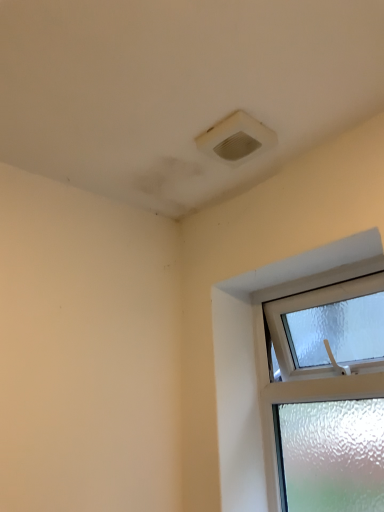
Describe the element at coordinates (265, 359) in the screenshot. The image size is (384, 512). I see `clear glass window at upper right` at that location.

Where is `clear glass window at upper right`? The height and width of the screenshot is (512, 384). clear glass window at upper right is located at coordinates (265, 359).

The height and width of the screenshot is (512, 384). Find the location of `white plastic air conditioning at upper center`. white plastic air conditioning at upper center is located at coordinates 236,139.

The image size is (384, 512). Describe the element at coordinates (236, 139) in the screenshot. I see `white plastic air conditioning at upper center` at that location.

Locate an element on the screen. This screenshot has width=384, height=512. clear glass window at upper right is located at coordinates (265, 359).

Which is more to the left, white plastic air conditioning at upper center or clear glass window at upper right?

white plastic air conditioning at upper center is more to the left.

Which is behind, white plastic air conditioning at upper center or clear glass window at upper right?

white plastic air conditioning at upper center is further away from the camera.

Does point (218, 150) come in front of point (238, 426)?

Yes, it is.

From the image's perspective, between white plastic air conditioning at upper center and clear glass window at upper right, which one is located above?

white plastic air conditioning at upper center, from the image's perspective.

From a real-world perspective, is white plastic air conditioning at upper center physically located above or below clear glass window at upper right?

In terms of real-world spatial position, white plastic air conditioning at upper center is above clear glass window at upper right.

Considering the sizes of objects white plastic air conditioning at upper center and clear glass window at upper right in the image provided, who is thinner, white plastic air conditioning at upper center or clear glass window at upper right?

With smaller width is clear glass window at upper right.

Is white plastic air conditioning at upper center shorter than clear glass window at upper right?

Correct, white plastic air conditioning at upper center is not as tall as clear glass window at upper right.

Between white plastic air conditioning at upper center and clear glass window at upper right, which one has larger size?

With larger size is clear glass window at upper right.

Can we say white plastic air conditioning at upper center lies outside clear glass window at upper right?

white plastic air conditioning at upper center lies outside clear glass window at upper right's area.

Is white plastic air conditioning at upper center directly adjacent to clear glass window at upper right?

No, white plastic air conditioning at upper center is not making contact with clear glass window at upper right.

In the scene shown: Is white plastic air conditioning at upper center facing towards clear glass window at upper right?

No, white plastic air conditioning at upper center is not facing towards clear glass window at upper right.

Measure the distance between white plastic air conditioning at upper center and clear glass window at upper right.

A distance of 22.65 inches exists between white plastic air conditioning at upper center and clear glass window at upper right.

Find the location of a particular element. Image resolution: width=384 pixels, height=512 pixels. air conditioning that is above the clear glass window at upper right (from the image's perspective) is located at coordinates (236, 139).

Considering the positions of objects clear glass window at upper right and white plastic air conditioning at upper center in the image provided, who is more to the right, clear glass window at upper right or white plastic air conditioning at upper center?

clear glass window at upper right is more to the right.

Which object is closer to the camera taking this photo, clear glass window at upper right or white plastic air conditioning at upper center?

clear glass window at upper right is in front.

Which is closer to the camera, (251, 304) or (201, 148)?

The point (201, 148) is more forward.

From the image's perspective, between clear glass window at upper right and white plastic air conditioning at upper center, who is located below?

From the image's view, clear glass window at upper right is below.

From a real-world perspective, is clear glass window at upper right under white plastic air conditioning at upper center?

Yes, from a real-world perspective, clear glass window at upper right is below white plastic air conditioning at upper center.

Between clear glass window at upper right and white plastic air conditioning at upper center, which one has smaller width?

With smaller width is clear glass window at upper right.

Considering the sizes of clear glass window at upper right and white plastic air conditioning at upper center in the image, is clear glass window at upper right taller or shorter than white plastic air conditioning at upper center?

Clearly, clear glass window at upper right is taller compared to white plastic air conditioning at upper center.

Considering the sizes of objects clear glass window at upper right and white plastic air conditioning at upper center in the image provided, who is smaller, clear glass window at upper right or white plastic air conditioning at upper center?

With smaller size is white plastic air conditioning at upper center.

Is clear glass window at upper right inside or outside of white plastic air conditioning at upper center?

clear glass window at upper right lies outside white plastic air conditioning at upper center.

Is clear glass window at upper right touching white plastic air conditioning at upper center?

They are not placed beside each other.

Is clear glass window at upper right looking in the opposite direction of white plastic air conditioning at upper center?

clear glass window at upper right does not have its back to white plastic air conditioning at upper center.

Looking at this image, how far apart are clear glass window at upper right and white plastic air conditioning at upper center?

clear glass window at upper right is 22.65 inches from white plastic air conditioning at upper center.

Find the location of `air conditioning on the left of the clear glass window at upper right`. air conditioning on the left of the clear glass window at upper right is located at coordinates (236, 139).

This screenshot has width=384, height=512. I want to click on window in front of the white plastic air conditioning at upper center, so click(x=265, y=359).

Where is `air conditioning that is above the clear glass window at upper right (from the image's perspective)`? Image resolution: width=384 pixels, height=512 pixels. air conditioning that is above the clear glass window at upper right (from the image's perspective) is located at coordinates (236, 139).